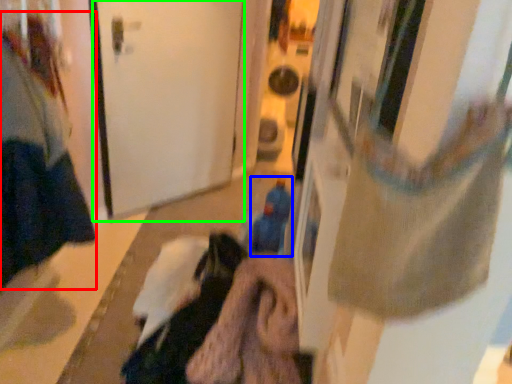
Question: Based on their relative distances, which object is farther from woman (highlighted by a red box)? Choose from toy (highlighted by a blue box) and door (highlighted by a green box).

Choices:
 (A) toy
 (B) door

Answer: (A)